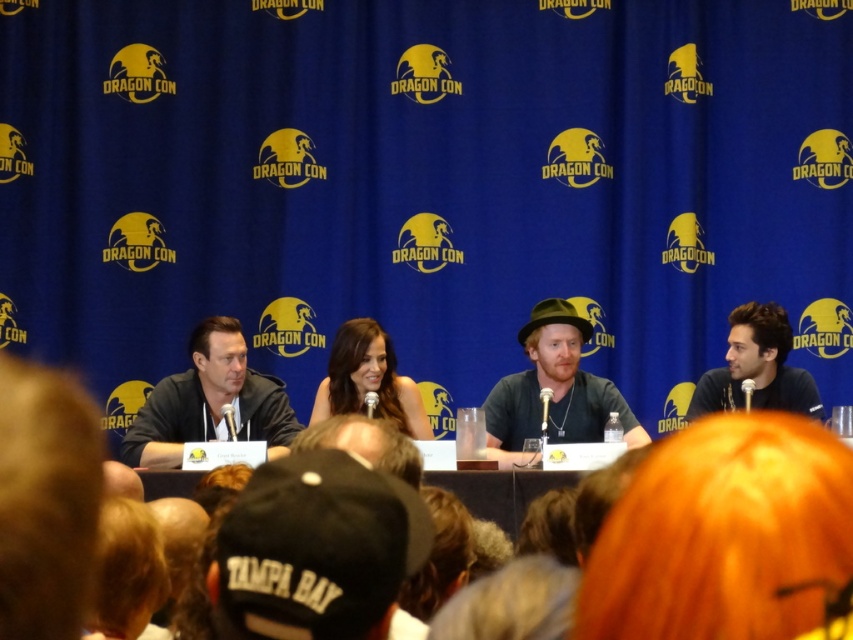
Is point (573, 397) farther from camera compared to point (741, 348)?

No, (573, 397) is closer to viewer.

Is matte black hat at center above dark brown hair at right?

Actually, matte black hat at center is below dark brown hair at right.

Which is in front, point (537, 333) or point (756, 353)?

Point (756, 353)

Where is `matte black hat at center`? This screenshot has height=640, width=853. matte black hat at center is located at coordinates (553, 390).

Is matte black hat at center positioned at the back of smooth brown hair at center?

Yes, it is behind smooth brown hair at center.

This screenshot has height=640, width=853. Describe the element at coordinates (553, 390) in the screenshot. I see `matte black hat at center` at that location.

What do you see at coordinates (553, 390) in the screenshot? Image resolution: width=853 pixels, height=640 pixels. I see `matte black hat at center` at bounding box center [553, 390].

The image size is (853, 640). I want to click on matte black hat at center, so click(x=553, y=390).

Is black leather jacket at left below matte black hat at center?

Correct, black leather jacket at left is located below matte black hat at center.

Does point (206, 346) lie behind point (498, 440)?

Yes, it is behind point (498, 440).

Where is `black leather jacket at left`? black leather jacket at left is located at coordinates (209, 401).

Locate an element on the screen. This screenshot has height=640, width=853. black leather jacket at left is located at coordinates (209, 401).